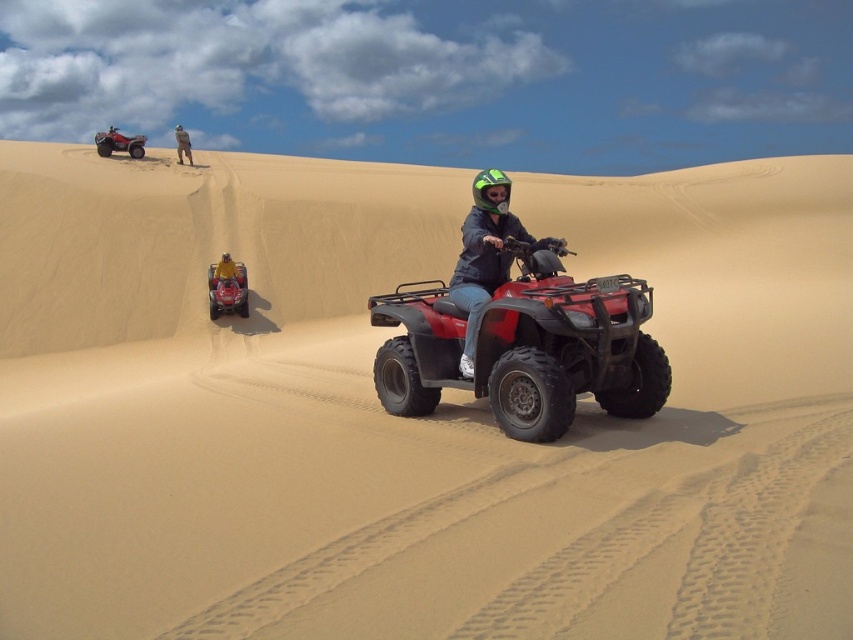
You are a photographer trying to capture both the shiny black helmet at center and the yellow fabric jacket at center in a single frame. Which object should you focus on first to ensure both are in focus, considering their sizes and positions?

The shiny black helmet at center is smaller than the yellow fabric jacket at center, so you should focus on the yellow fabric jacket at center first to ensure both are in focus.

You are a safety inspector checking the spacing between two helmets in a desert scene. The helmets are labeled as matte black helmet at center and shiny black helmet at center. According to safety regulations, helmets must be at least 50 centimeters apart to prevent collisions. Can the helmets meet this requirement?

The matte black helmet at center is 40.73 centimeters from the shiny black helmet at center. Since 40.73 cm is less than the required 50 cm, the helmets do not meet the safety requirement.